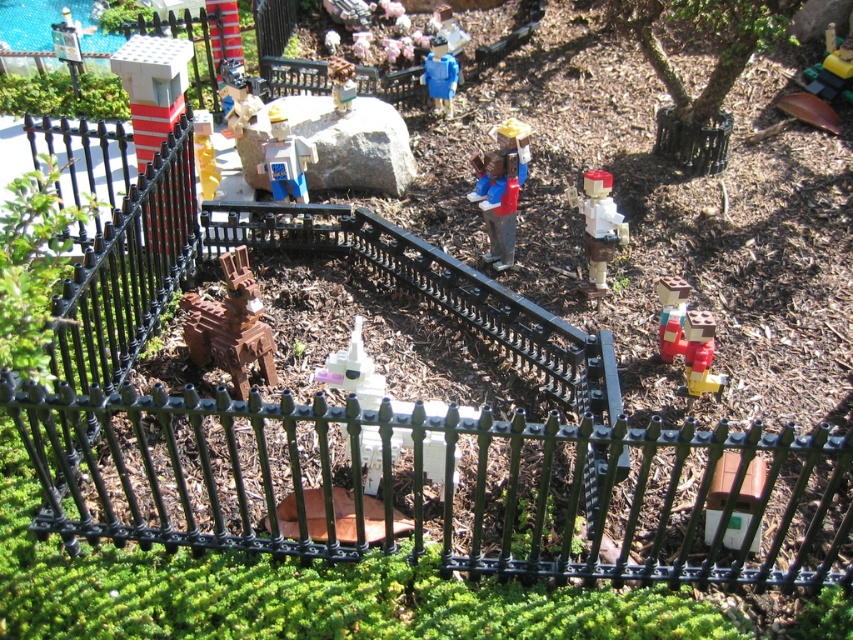
Question: Which of the following is the farthest from the observer?

Choices:
 (A) (491, 257)
 (B) (334, 60)
 (C) (244, 310)
 (D) (235, 74)

Answer: (B)

Question: Which point is closer to the camera?

Choices:
 (A) yellow plastic traffic light at center
 (B) smooth brown wooden figure at upper center
 (C) brown wooden horse at center
 (D) white plastic unicorn at center

Answer: (C)

Question: Does smooth brown wooden figure at upper center appear on the left side of yellow plastic traffic light at center?

Choices:
 (A) yes
 (B) no

Answer: (A)

Question: Observing the image, what is the correct spatial positioning of white matte figure at center-right in reference to white plastic unicorn at center?

Choices:
 (A) below
 (B) above

Answer: (A)

Question: In this image, where is brown wooden horse at center located relative to brick red plastic figure at lower right?

Choices:
 (A) below
 (B) above

Answer: (B)

Question: Which of the following is the farthest from the observer?

Choices:
 (A) brown wooden horse at center
 (B) brick red plastic figure at lower right

Answer: (B)